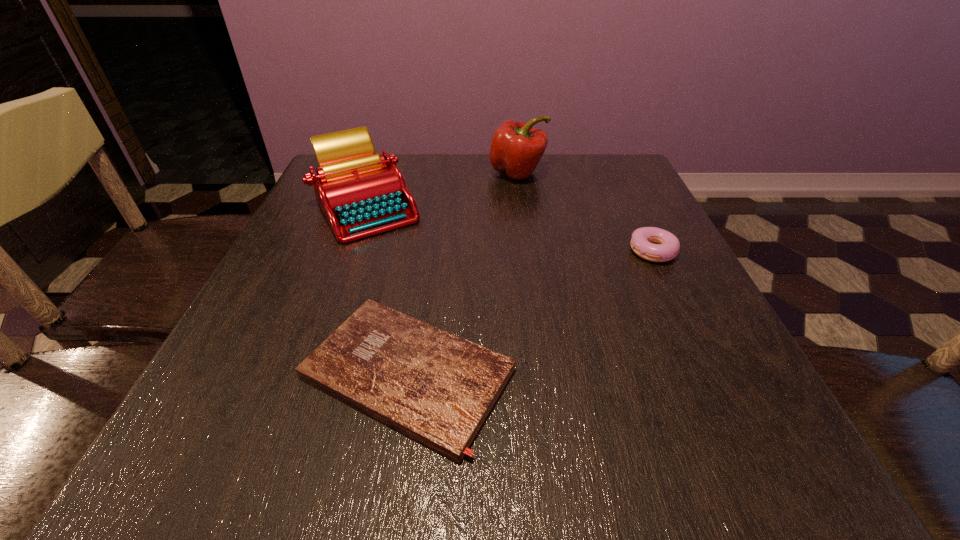
The image size is (960, 540). I want to click on free space that satisfies the following two spatial constraints: 1. on the typing side of the shortest object; 2. on the left side of the typewriter, so click(305, 374).